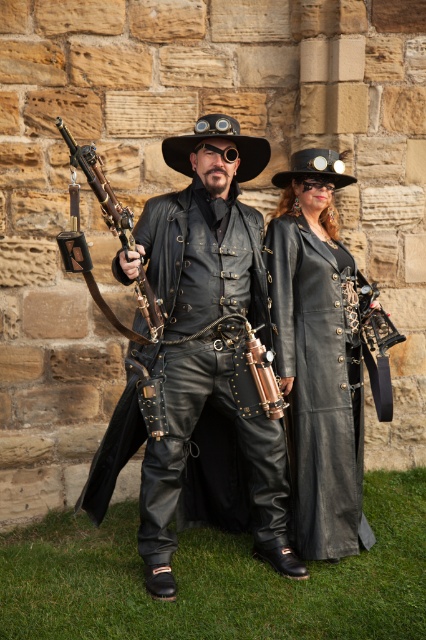
Does leather jacket at center have a greater height compared to polished brass rifle at center?

Indeed, leather jacket at center has a greater height compared to polished brass rifle at center.

Is point (293, 568) behind point (150, 316)?

Yes, point (293, 568) is behind point (150, 316).

Find the location of a particular element. The width and height of the screenshot is (426, 640). leather jacket at center is located at coordinates (207, 339).

At what (x,y) coordinates should I click in order to perform the action: click on leather jacket at center. Please return your answer as a coordinate pair (x, y). The image size is (426, 640). Looking at the image, I should click on (207, 339).

Which is below, matte black coat at center or polished brass rifle at center?

Positioned lower is matte black coat at center.

Image resolution: width=426 pixels, height=640 pixels. Find the location of `matte black coat at center`. matte black coat at center is located at coordinates 319,356.

I want to click on matte black coat at center, so click(x=319, y=356).

Where is `matte black coat at center`? matte black coat at center is located at coordinates (319, 356).

Between leather jacket at center and matte black coat at center, which one has less height?

With less height is matte black coat at center.

Who is positioned more to the right, leather jacket at center or matte black coat at center?

From the viewer's perspective, matte black coat at center appears more on the right side.

What do you see at coordinates (207, 339) in the screenshot?
I see `leather jacket at center` at bounding box center [207, 339].

Identify the location of leather jacket at center. (207, 339).